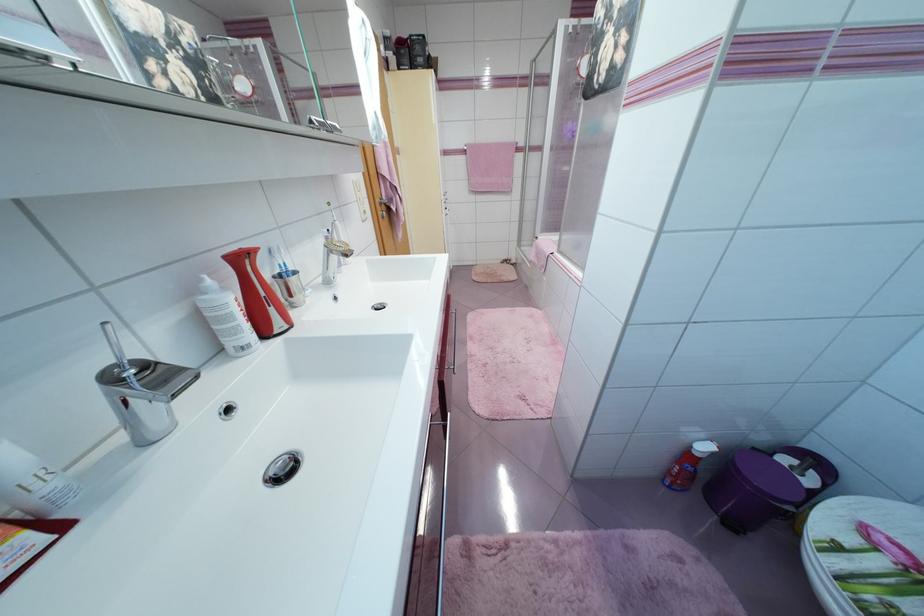
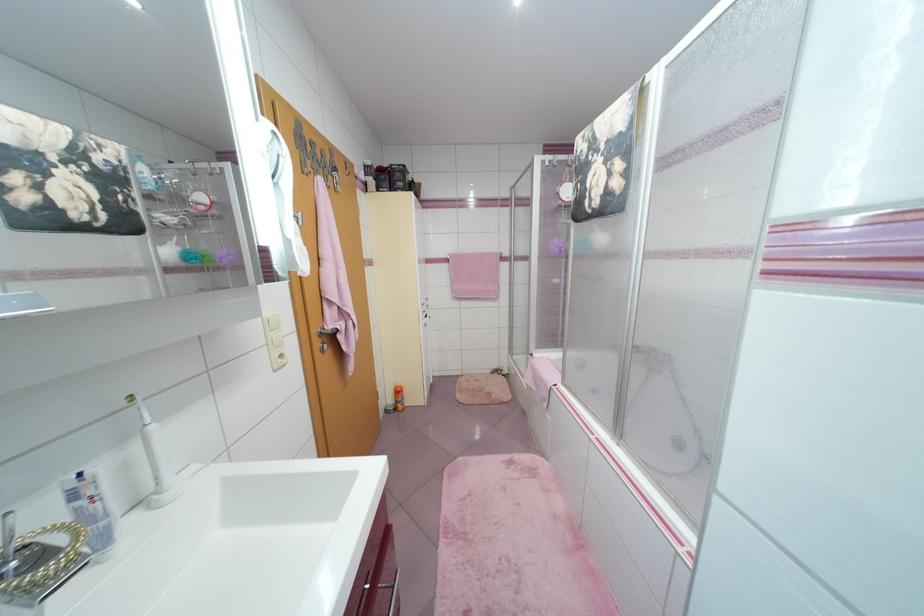
Question: The images are taken continuously from a first-person perspective. In which direction is your viewpoint rotating?

Choices:
 (A) Left
 (B) Right
 (C) Up
 (D) Down

Answer: (C)